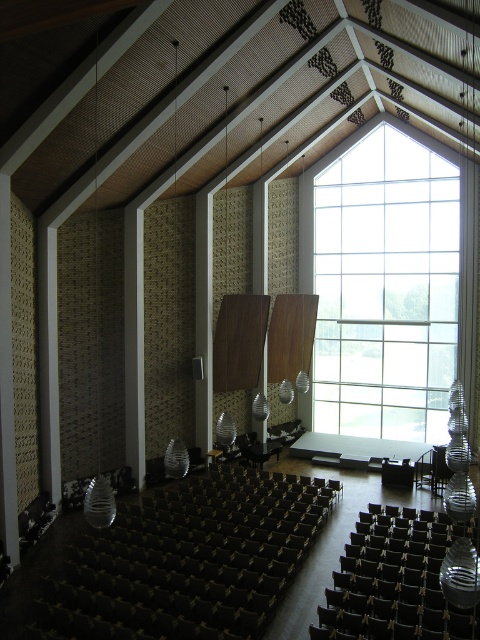
You are an architect reviewing the concert hall design. The clear glass window at upper center is crucial for natural lighting. Can you confirm its exact location coordinates?

The clear glass window at upper center is located at coordinates point (389, 282).

You are a stagehand in a concert hall. You need to place a large banner that is 20 meters long. The banner must be placed in a straight line from the camera position to the clear glass window at upper center. Is the distance sufficient to fit the banner?

The clear glass window at upper center is 19.22 meters away from the camera. Since the banner is 20 meters long, the distance is insufficient to fit the banner in a straight line from the camera to the window.